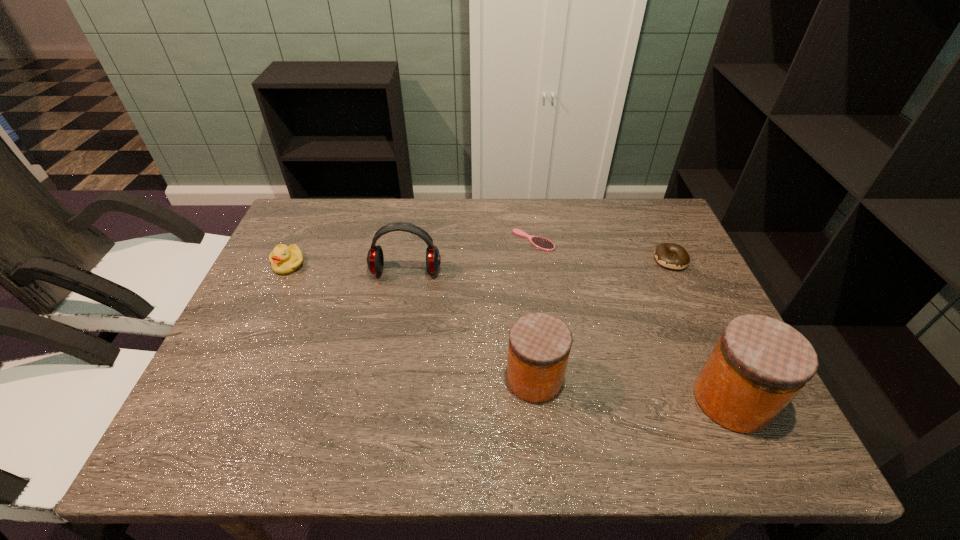
Please point a free position for a jar on the left. Please provide its 2D coordinates. Your answer should be formatted as a tuple, i.e. [(x, y)], where the tuple contains the x and y coordinates of a point satisfying the conditions above.

[(352, 359)]